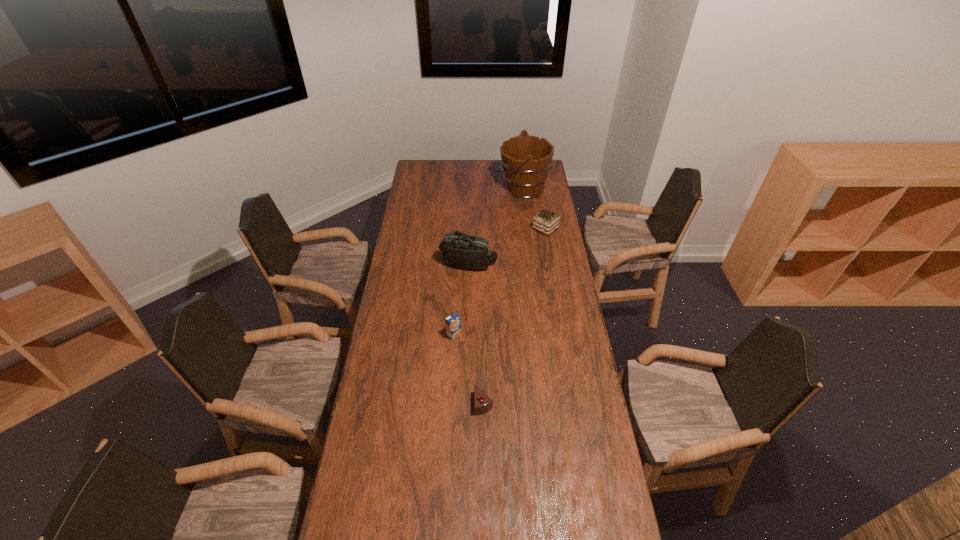
In order to click on vacant point located between the shorter chocolate cake and the second farthest object in this screenshot , I will do `click(515, 316)`.

Find the location of `object that stands as the fourth closest to the third nearest object`. object that stands as the fourth closest to the third nearest object is located at coordinates pyautogui.click(x=483, y=403).

Locate which object is the closest to the taller chocolate cake. Please provide its 2D coordinates. Your answer should be formatted as a tuple, i.e. [(x, y)], where the tuple contains the x and y coordinates of a point satisfying the conditions above.

[(525, 160)]

Where is `vacant area in the image that satisfies the following two spatial constraints: 1. with the handle on the tallest object; 2. on the left side of the taller chocolate cake`? The width and height of the screenshot is (960, 540). vacant area in the image that satisfies the following two spatial constraints: 1. with the handle on the tallest object; 2. on the left side of the taller chocolate cake is located at coordinates (x=529, y=228).

Identify the location of vacant space that satisfies the following two spatial constraints: 1. at the front padded panel of the fourth shortest object; 2. on the left side of the nearer chocolate cake. This screenshot has width=960, height=540. (465, 404).

Find the location of a particular element. free spot that satisfies the following two spatial constraints: 1. at the front padded panel of the third farthest object; 2. on the right side of the nearer chocolate cake is located at coordinates (465, 404).

Where is `free space that satisfies the following two spatial constraints: 1. with the handle on the farthest object; 2. on the right side of the fourth nearest object`? The height and width of the screenshot is (540, 960). free space that satisfies the following two spatial constraints: 1. with the handle on the farthest object; 2. on the right side of the fourth nearest object is located at coordinates (529, 228).

Image resolution: width=960 pixels, height=540 pixels. Find the location of `vacant space that satisfies the following two spatial constraints: 1. with the handle on the farthest object; 2. at the front padded panel of the fourth shortest object`. vacant space that satisfies the following two spatial constraints: 1. with the handle on the farthest object; 2. at the front padded panel of the fourth shortest object is located at coordinates (534, 263).

Where is `vacant point that satisfies the following two spatial constraints: 1. with the handle on the wine bucket; 2. on the front side of the shorter chocolate cake`? The height and width of the screenshot is (540, 960). vacant point that satisfies the following two spatial constraints: 1. with the handle on the wine bucket; 2. on the front side of the shorter chocolate cake is located at coordinates (552, 404).